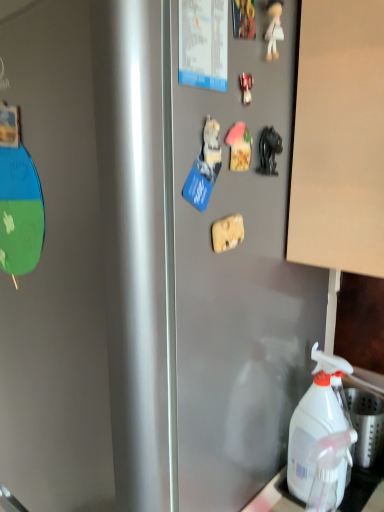
What do you see at coordinates (314, 421) in the screenshot?
I see `white plastic spray bottle at lower right` at bounding box center [314, 421].

Measure the distance between white plastic spray bottle at lower right and camera.

The depth of white plastic spray bottle at lower right is 26.10 inches.

Locate an element on the screen. This screenshot has height=512, width=384. white plastic spray bottle at lower right is located at coordinates coord(314,421).

At what (x,y) coordinates should I click in order to perform the action: click on white plastic spray bottle at lower right. Please return your answer as a coordinate pair (x, y). Looking at the image, I should click on point(314,421).